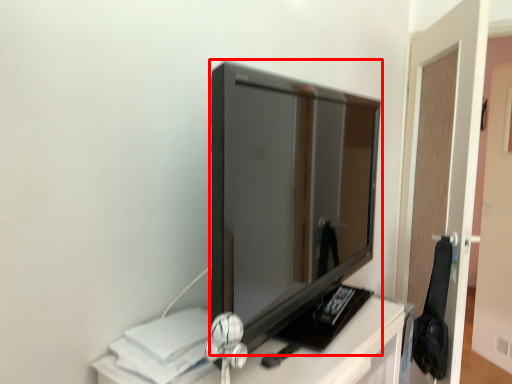
Question: From the image's perspective, where is television (annotated by the red box) located relative to glass door?

Choices:
 (A) below
 (B) above

Answer: (B)